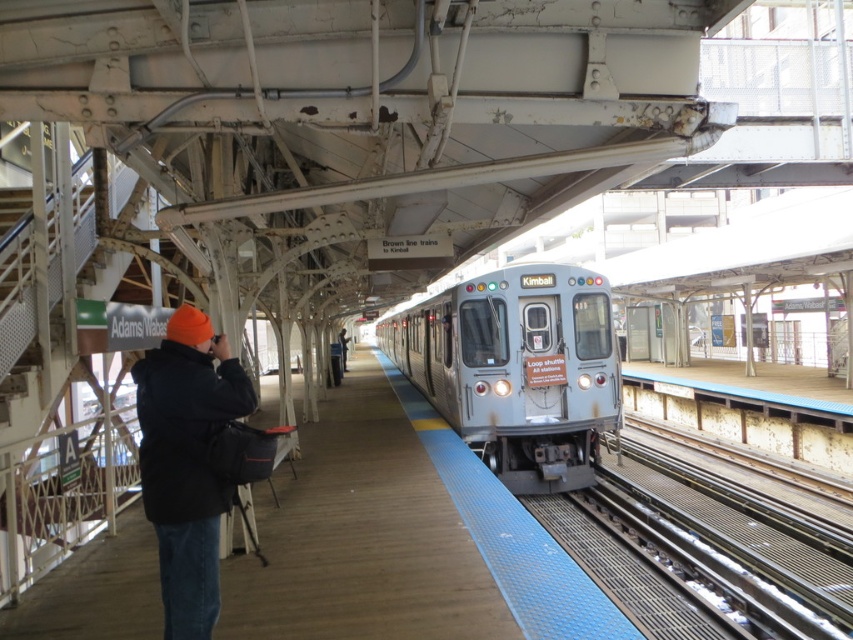
Question: Is blue textured platform at center wider than silver metallic train at center?

Choices:
 (A) no
 (B) yes

Answer: (A)

Question: Which point is closer to the camera?

Choices:
 (A) tap(346, 356)
 (B) tap(415, 444)

Answer: (B)

Question: Which object is positioned farthest from the silver metallic train at center?

Choices:
 (A) black fleece jacket at left
 (B) black jacket at center

Answer: (A)

Question: Does blue textured platform at center appear on the left side of black jacket at center?

Choices:
 (A) yes
 (B) no

Answer: (B)

Question: Can you confirm if blue textured platform at center is positioned to the right of silver metallic train at center?

Choices:
 (A) no
 (B) yes

Answer: (A)

Question: Which point appears farthest from the camera in this image?

Choices:
 (A) [207, 333]
 (B) [608, 632]
 (C) [343, 336]
 (D) [590, 426]

Answer: (C)